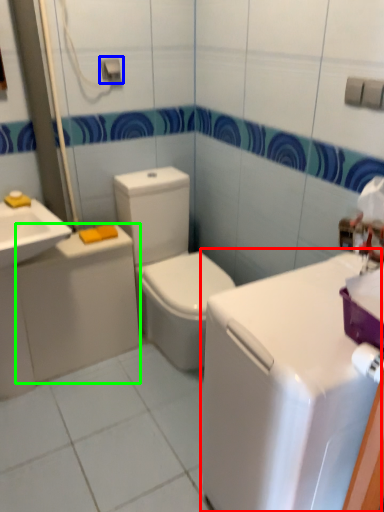
Question: Considering the real-world distances, which object is farthest from counter top (highlighted by a red box)? towel bar (highlighted by a blue box) or appliance (highlighted by a green box)?

Choices:
 (A) towel bar
 (B) appliance

Answer: (A)